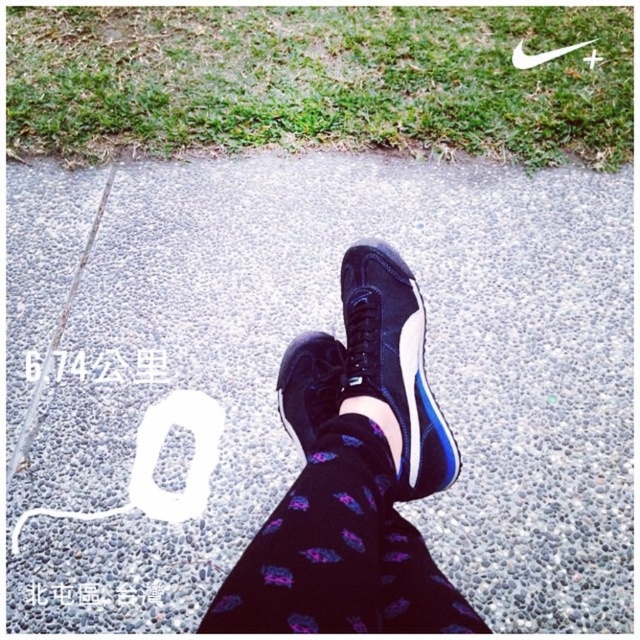
You are trying to decide between two pairs of sneakers displayed in the image. The matte black sneakers at center and the black synthetic sneaker at center. Which one has a wider base?

The matte black sneakers at center might be wider than the black synthetic sneaker at center according to the description provided.

In the scene shown: You are a photographer trying to capture the black synthetic sneaker at center and the matte black sneakers at center in the same frame. Based on their positions, which one appears closer to the camera?

The matte black sneakers at center appears closer to the camera because it is located below the black synthetic sneaker at center, indicating it is in a lower plane from the viewer.